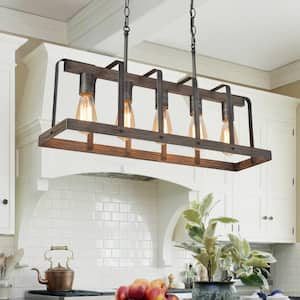
The image size is (300, 300). In order to click on handle in this screenshot , I will do `click(265, 217)`.